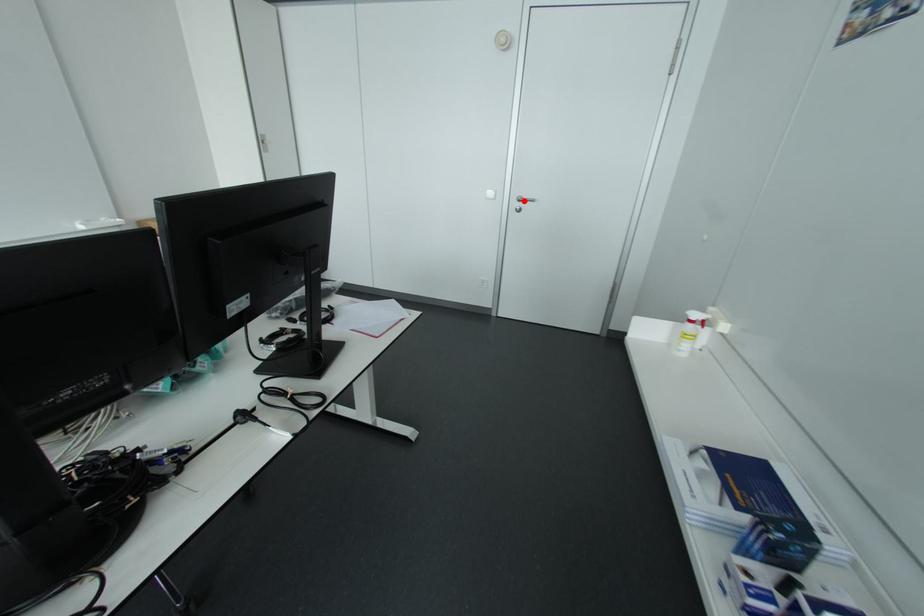
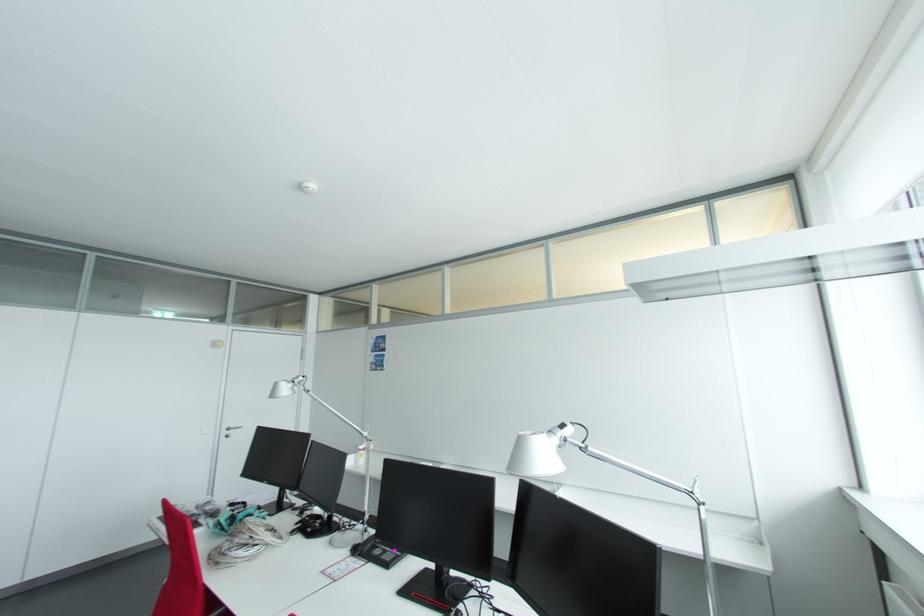
In the second image, find the point that corresponds to the highlighted location in the first image.

(232, 430)